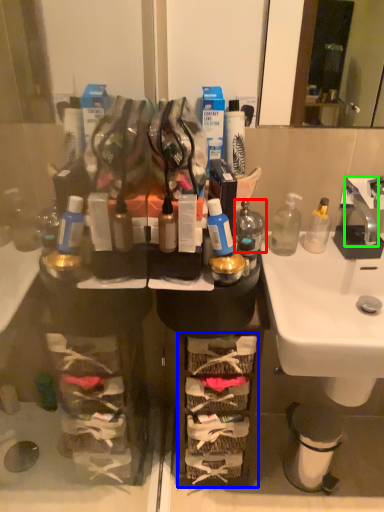
Question: Based on their relative distances, which object is nearer to bottle (highlighted by a red box)? Choose from shelf (highlighted by a blue box) and faucet (highlighted by a green box).

Choices:
 (A) shelf
 (B) faucet

Answer: (B)